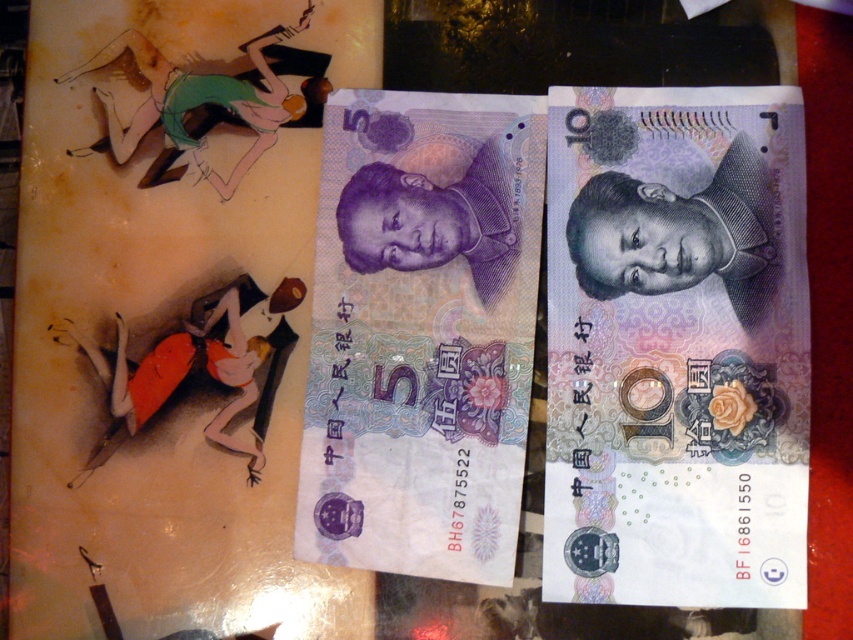
Question: Among these points, which one is farthest from the camera?

Choices:
 (A) (509, 154)
 (B) (611, 528)

Answer: (A)

Question: Does matte purple banknote at center have a larger size compared to purple paper money at center?

Choices:
 (A) yes
 (B) no

Answer: (A)

Question: Does matte purple banknote at center appear over purple paper money at center?

Choices:
 (A) no
 (B) yes

Answer: (A)

Question: Can you confirm if matte purple banknote at center is positioned above purple paper money at center?

Choices:
 (A) no
 (B) yes

Answer: (A)